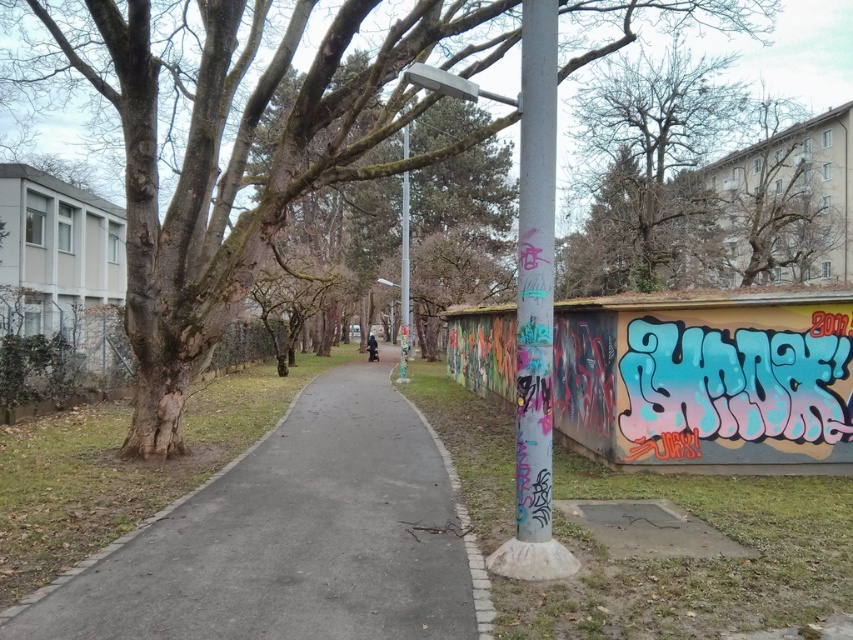
Between bare branches at upper center and smooth gray pole at center, which one has less height?

With less height is smooth gray pole at center.

Is bare branches at upper center taller than smooth gray pole at center?

Yes.

Who is more distant from viewer, (619, 96) or (407, 308)?

The point (619, 96) is behind.

Where is `bare branches at upper center`? bare branches at upper center is located at coordinates click(x=645, y=168).

Does point (524, 454) come farther from viewer compared to point (403, 275)?

No, it is not.

Which is more to the right, graffiti-covered metal pole at center-right or smooth gray pole at center?

graffiti-covered metal pole at center-right

Who is more distant from viewer, (537, 124) or (401, 337)?

The point (401, 337) is more distant.

At what (x,y) coordinates should I click in order to perform the action: click on graffiti-covered metal pole at center-right. Please return your answer as a coordinate pair (x, y). The image size is (853, 640). Looking at the image, I should click on (535, 273).

Does bare branches at upper center have a lesser width compared to graffiti-covered metal pole at center-right?

No.

Does point (677, 97) come behind point (544, 12)?

Yes, point (677, 97) is farther from viewer.

Identify the location of bare branches at upper center. (645, 168).